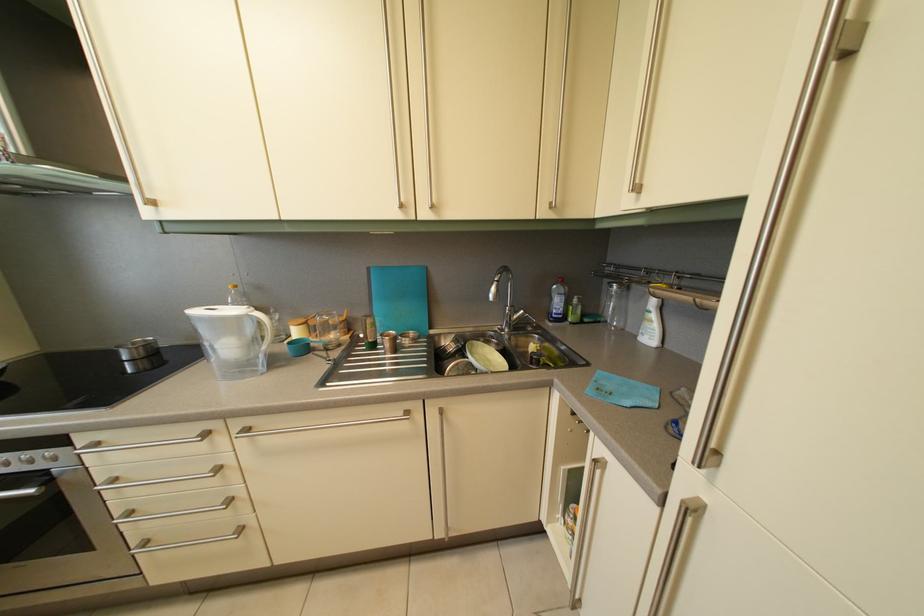
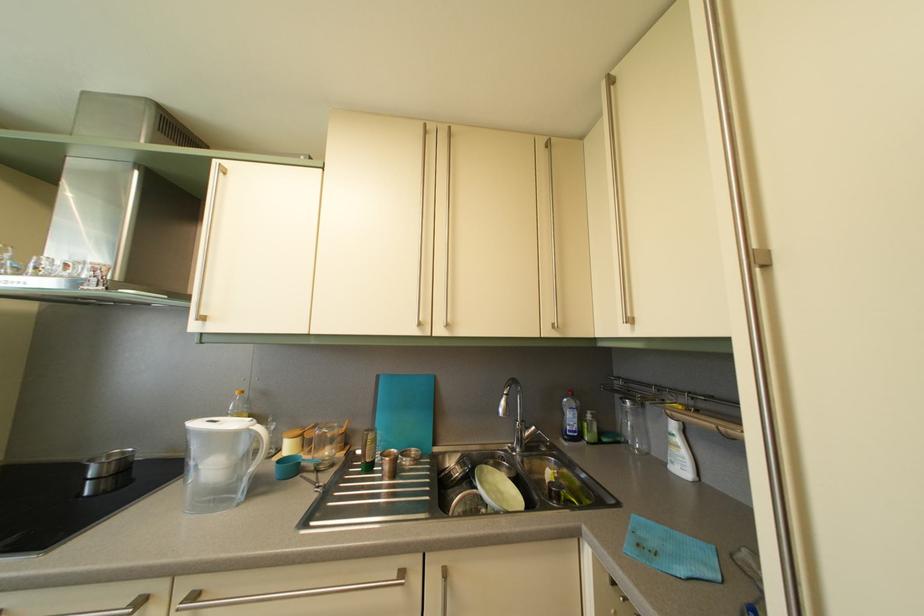
Question: I am providing you with two images of the same scene from different viewpoints. After the viewpoint changes to image2, which objects are now occluded?

Choices:
 (A) pump dispenser
 (B) short silver handle
 (C) oil bottle
 (D) none of these

Answer: (D)